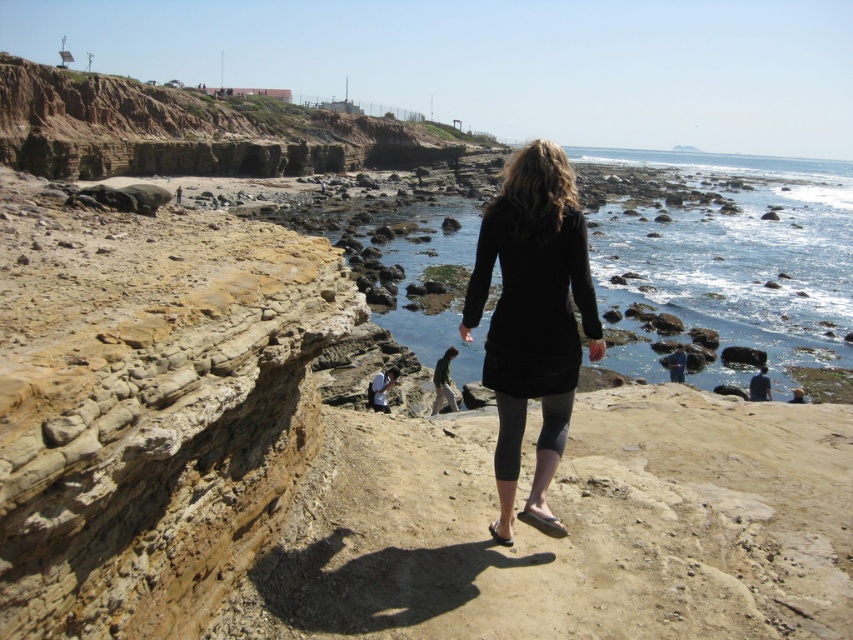
You are a photographer trying to capture the person in the black matte dress at center and the dark blue fabric at lower right in the same frame. Which object should you focus on first to ensure both are in the frame?

The black matte dress at center is larger than the dark blue fabric at lower right, so you should focus on the black matte dress at center first to ensure both are in the frame.

You are a photographer positioned at the center of the image. You want to capture a shot of the black matte dress at center while avoiding the rocky formations on the left. Based on the dress location, will you need to adjust your camera angle to the right or left to frame it properly?

The black matte dress at center is located at point (532, 320), which is directly in the center of the image. Since the rocky formations are on the left, you don not need to adjust your camera angle to avoid them. Keep the camera centered to frame the dress properly.

You are a photographer trying to capture the person in the coastal scene. You notice two items at the lower right corner of your frame. Which object occupies more space in the image? The options are the dark blue fabric at lower right and the smooth gray pants at lower right.

The dark blue fabric at lower right occupies more space in the image because it is larger in size than the smooth gray pants at lower right.